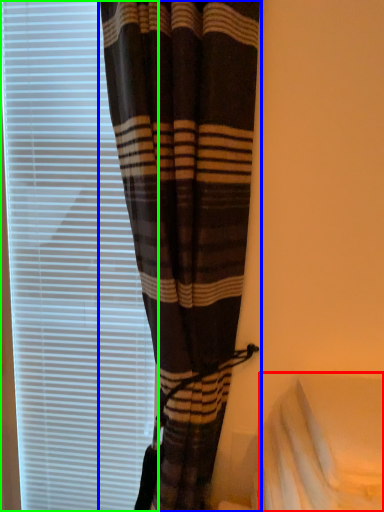
Question: Considering the real-world distances, which object is farthest from sheet (highlighted by a red box)? curtain (highlighted by a blue box) or window blind (highlighted by a green box)?

Choices:
 (A) curtain
 (B) window blind

Answer: (B)